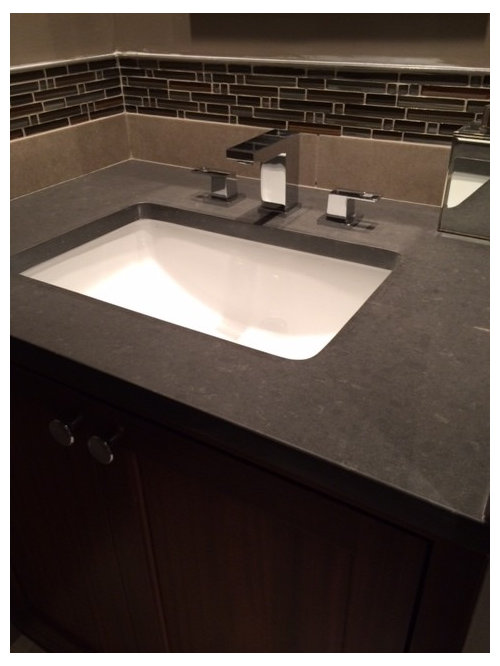
The width and height of the screenshot is (500, 666). What are the coordinates of `place turned to make water come out of faucet` in the screenshot? It's located at (367, 198), (198, 170).